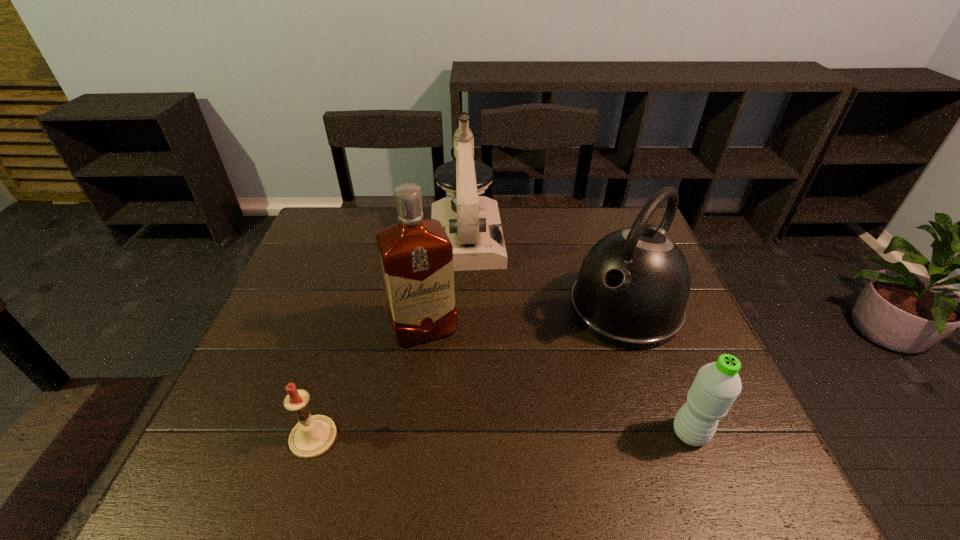
This screenshot has height=540, width=960. Identify the location of free point that satisfies the following two spatial constraints: 1. on the front side of the kettle; 2. on the right side of the water bottle. (668, 433).

Identify the location of free point that satisfies the following two spatial constraints: 1. on the back side of the liquor; 2. on the right side of the microscope. (436, 238).

At what (x,y) coordinates should I click in order to perform the action: click on blank space that satisfies the following two spatial constraints: 1. on the back side of the microscope; 2. on the left side of the leftmost object. Please return your answer as a coordinate pair (x, y). The height and width of the screenshot is (540, 960). Looking at the image, I should click on (374, 238).

Find the location of `free location that satisfies the following two spatial constraints: 1. on the front side of the water bottle; 2. on the left side of the liquor`. free location that satisfies the following two spatial constraints: 1. on the front side of the water bottle; 2. on the left side of the liquor is located at coordinates (411, 433).